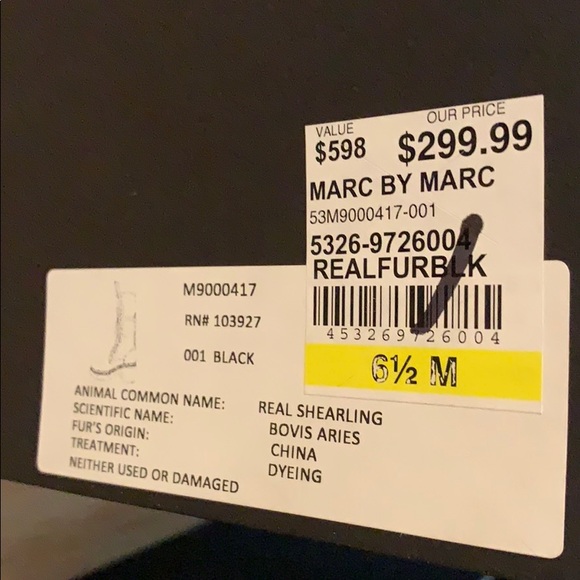
Where is `table`? The height and width of the screenshot is (580, 580). table is located at coordinates (70, 534).